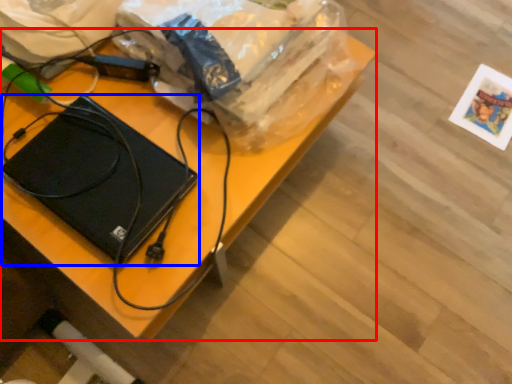
Question: Among these objects, which one is farthest to the camera, desk (highlighted by a red box) or laptop (highlighted by a blue box)?

Choices:
 (A) desk
 (B) laptop

Answer: (B)